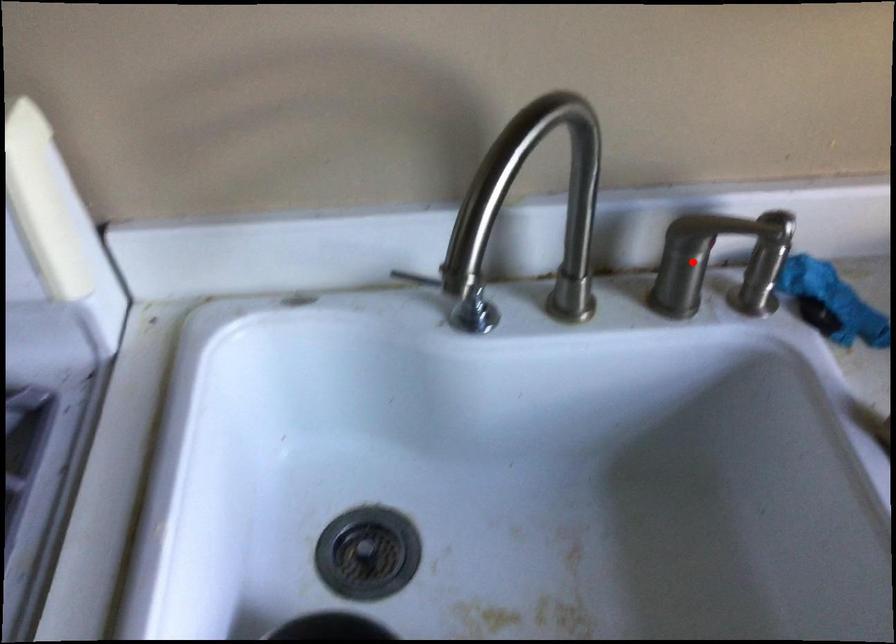
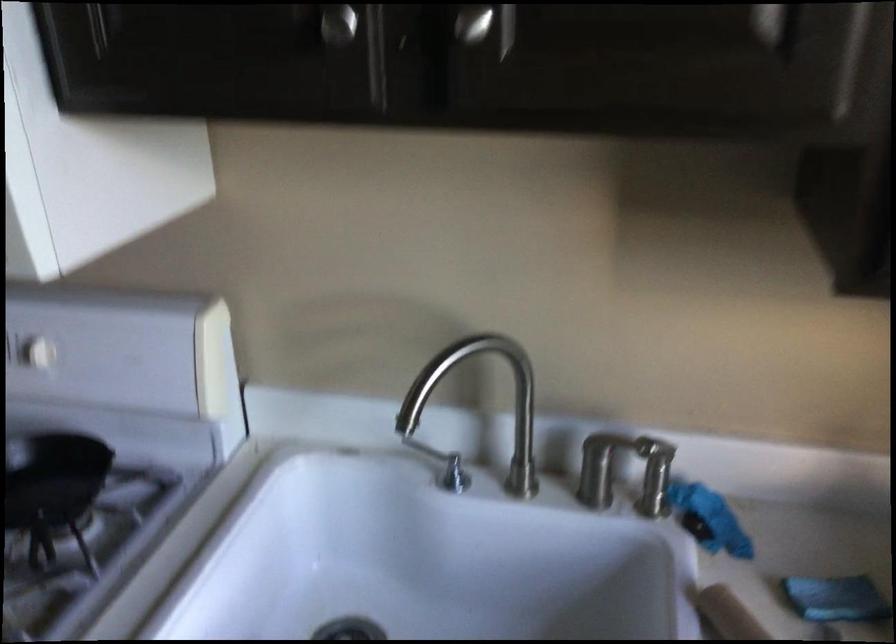
Where in the second image is the point corresponding to the highlighted location from the first image?

(606, 465)